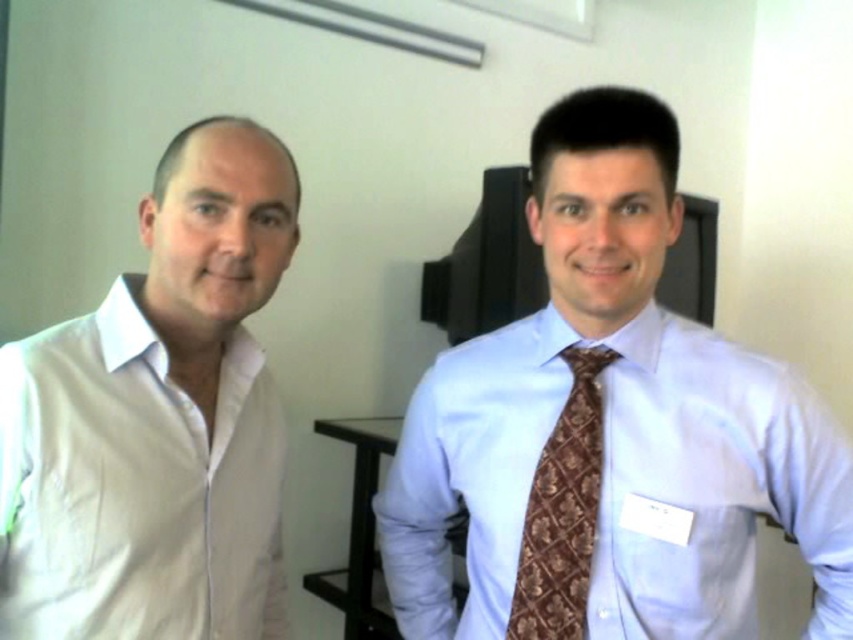
You are taking a photo of two points in the scene. The first point is labeled as point (120, 364) and the second is point (440, 515). Which point will appear larger in your photo?

Point (120, 364) is closer to the camera than point (440, 515), so it will appear larger in the photo.

You are a photographer setting up for a group photo. You need to ensure that both the white cotton shirt at left and the brown textured tie at center are fully visible in the frame. Based on their current positions, which object is closer to the camera and might block the other from view?

The white cotton shirt at left is in front of the brown textured tie at center, so it is closer to the camera and could potentially block the view of the brown textured tie at center.

You are standing in the room and see two points marked in the image. Which point is closer to you, point (236, 189) or point (543, 518)?

Point (236, 189) is in front of point (543, 518), so it is closer to you.